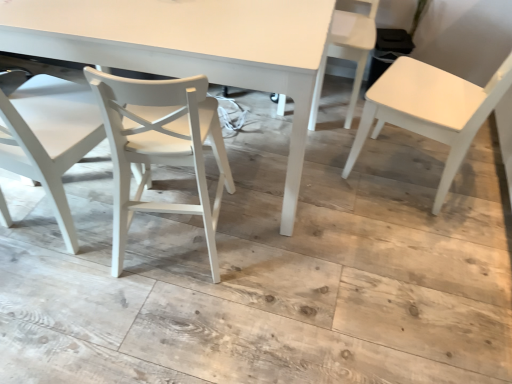
The height and width of the screenshot is (384, 512). I want to click on vacant area that lies between white matte chair at right, placed as the fourth chair when sorted from left to right, and white matte table at center, so click(350, 201).